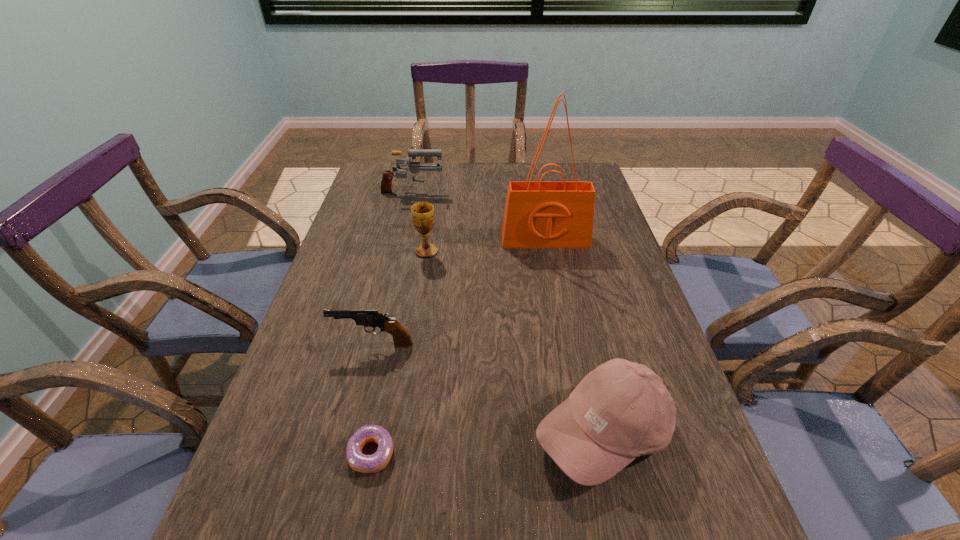
Where is `vacant position located 0.130m on the front of the chalice`? This screenshot has width=960, height=540. vacant position located 0.130m on the front of the chalice is located at coordinates (420, 291).

Locate an element on the screen. free space located 0.070m along the barrel of the second shortest object is located at coordinates (302, 345).

In order to click on free region located 0.070m on the right of the doughnut in this screenshot , I will do `click(433, 454)`.

Where is `object situated at the far edge`? The height and width of the screenshot is (540, 960). object situated at the far edge is located at coordinates (414, 167).

You are a GUI agent. You are given a task and a screenshot of the screen. Output one action in this format:
    pyautogui.click(x=<x>, y=<y>)
    Task: Click on the tote bag positioned at the right edge
    The width and height of the screenshot is (960, 540).
    Given the screenshot: What is the action you would take?
    pyautogui.click(x=538, y=214)

At what (x,y) coordinates should I click in order to perform the action: click on baseball cap that is at the right edge. Please return your answer as a coordinate pair (x, y). This screenshot has height=540, width=960. Looking at the image, I should click on [621, 410].

Find the location of `object present at the far left corner`. object present at the far left corner is located at coordinates (414, 167).

The width and height of the screenshot is (960, 540). I want to click on vacant space at the far edge, so click(548, 179).

Find the location of a particular element. The height and width of the screenshot is (540, 960). free space at the left edge of the desktop is located at coordinates (375, 227).

In the image, there is a desktop. Where is `vacant space at the right edge`? vacant space at the right edge is located at coordinates (598, 242).